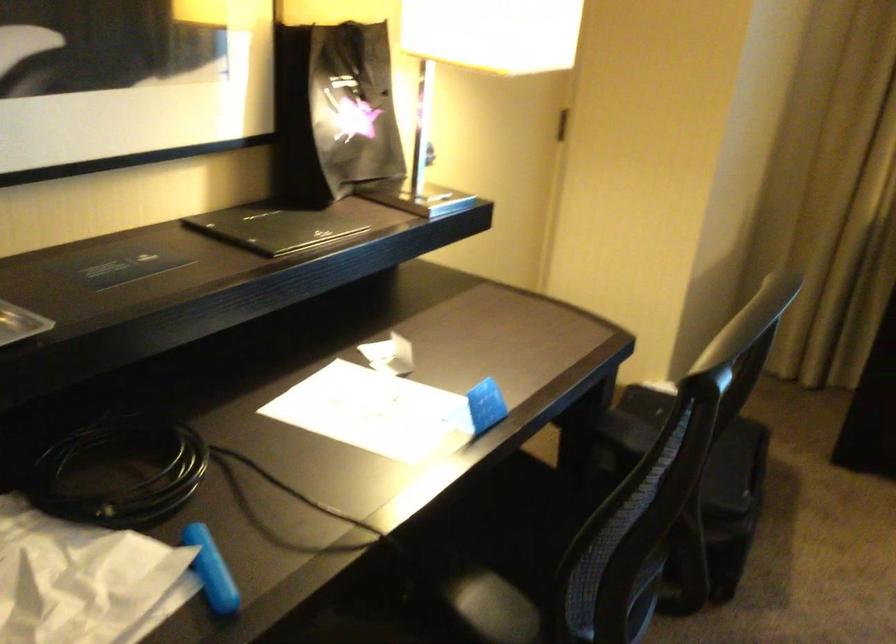
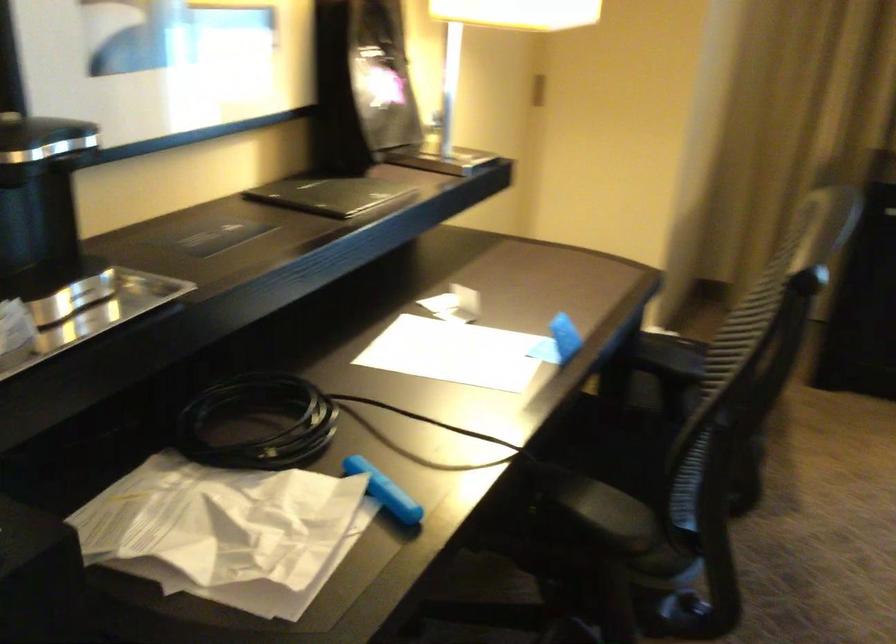
Question: The images are taken continuously from a first-person perspective. In which direction are you moving?

Choices:
 (A) Left
 (B) Right
 (C) Forward
 (D) Backward

Answer: (A)